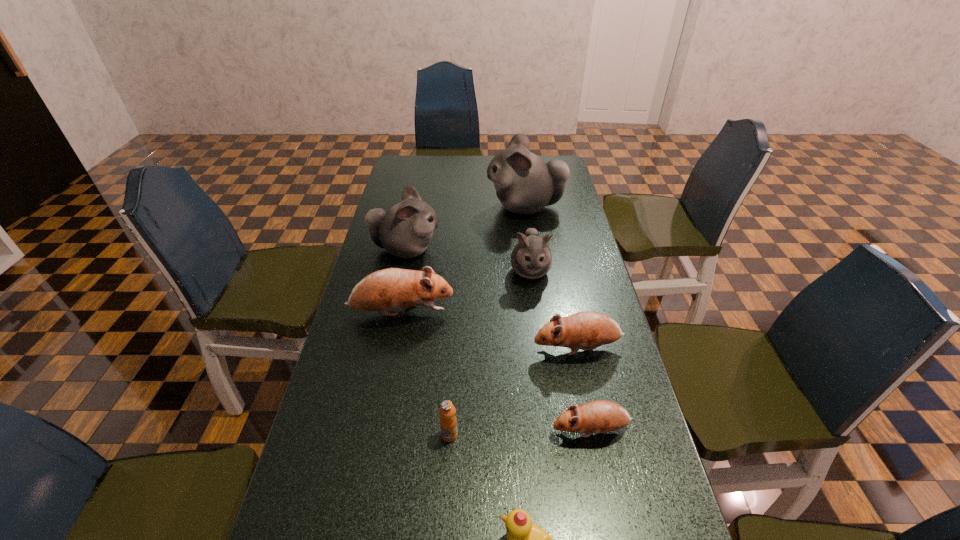
Identify the location of free spot between the farthest brown hamster and the second farthest brown hamster. (490, 330).

The width and height of the screenshot is (960, 540). Identify the location of unoccupied position between the leftmost brown hamster and the second nearest brown hamster. (490, 330).

Locate an element on the screen. free area in between the farthest hamster and the second shortest hamster is located at coordinates 551,278.

This screenshot has height=540, width=960. I want to click on unoccupied position between the orange juice and the farthest hamster, so click(488, 321).

Where is `free spot between the farthest brown hamster and the smallest white hamster`? Image resolution: width=960 pixels, height=540 pixels. free spot between the farthest brown hamster and the smallest white hamster is located at coordinates (466, 292).

Locate an element on the screen. This screenshot has width=960, height=540. vacant point located between the nearest hamster and the orange juice is located at coordinates (520, 433).

Identify the location of vacant region between the second tallest hamster and the fourth nearest object. This screenshot has height=540, width=960. (492, 299).

Locate which object ranks fourth in proximity to the yellow duckling. Please provide its 2D coordinates. Your answer should be formatted as a tuple, i.e. [(x, y)], where the tuple contains the x and y coordinates of a point satisfying the conditions above.

[(393, 288)]

Locate which object is the seventh closest to the fifth farthest object. Please provide its 2D coordinates. Your answer should be formatted as a tuple, i.e. [(x, y)], where the tuple contains the x and y coordinates of a point satisfying the conditions above.

[(525, 184)]

Identify which hamster is the fourth closest to the fifth shortest hamster. Please provide its 2D coordinates. Your answer should be formatted as a tuple, i.e. [(x, y)], where the tuple contains the x and y coordinates of a point satisfying the conditions above.

[(587, 330)]